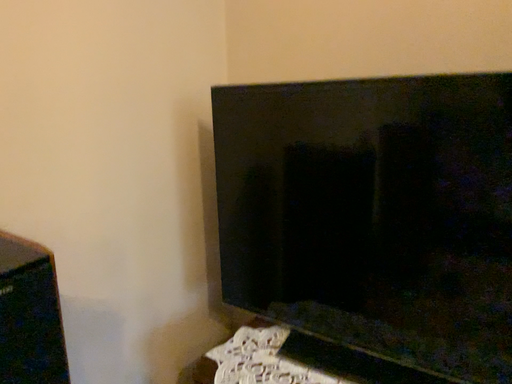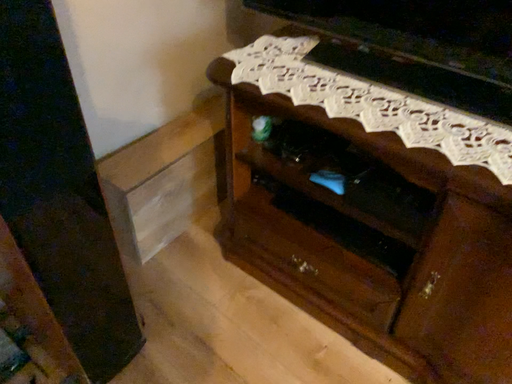
Question: Which way did the camera rotate in the video?

Choices:
 (A) rotated upward
 (B) rotated downward

Answer: (B)